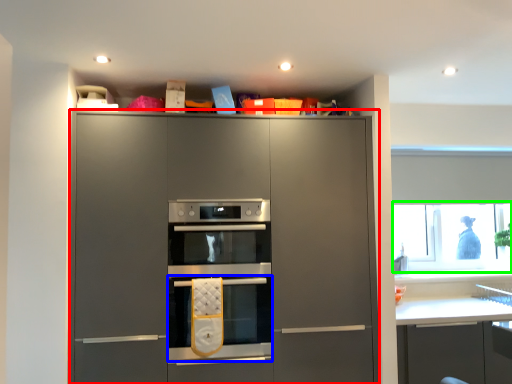
Question: Which is nearer to the cabinetry (highlighted by a red box)? oven (highlighted by a blue box) or window screen (highlighted by a green box).

Choices:
 (A) oven
 (B) window screen

Answer: (A)